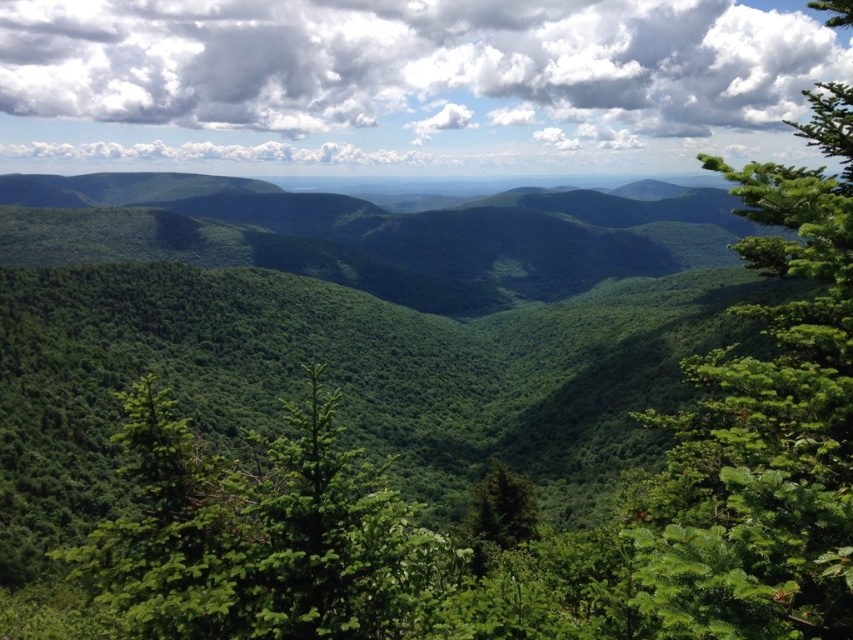
Question: Estimate the real-world distances between objects in this image. Which object is closer to the green matte tree at center?

Choices:
 (A) green leafy tree at right
 (B) green leafy forest at center
 (C) white fluffy cloud at upper center

Answer: (A)

Question: Is green leafy forest at center to the left of white fluffy cloud at upper center from the viewer's perspective?

Choices:
 (A) yes
 (B) no

Answer: (B)

Question: In this image, where is green leafy forest at center located relative to green matte tree at center?

Choices:
 (A) below
 (B) above

Answer: (B)

Question: Which object appears farthest from the camera in this image?

Choices:
 (A) green leafy forest at center
 (B) green leafy tree at right

Answer: (A)

Question: Which point is closer to the camera taking this photo?

Choices:
 (A) (483, 497)
 (B) (396, 406)

Answer: (A)

Question: Does green leafy forest at center appear on the left side of green matte tree at center?

Choices:
 (A) no
 (B) yes

Answer: (A)